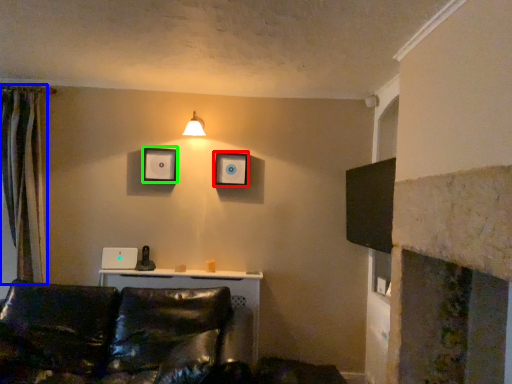
Question: Estimate the real-world distances between objects in this image. Which object is closer to picture frame (highlighted by a red box), curtain (highlighted by a blue box) or picture frame (highlighted by a green box)?

Choices:
 (A) curtain
 (B) picture frame

Answer: (B)